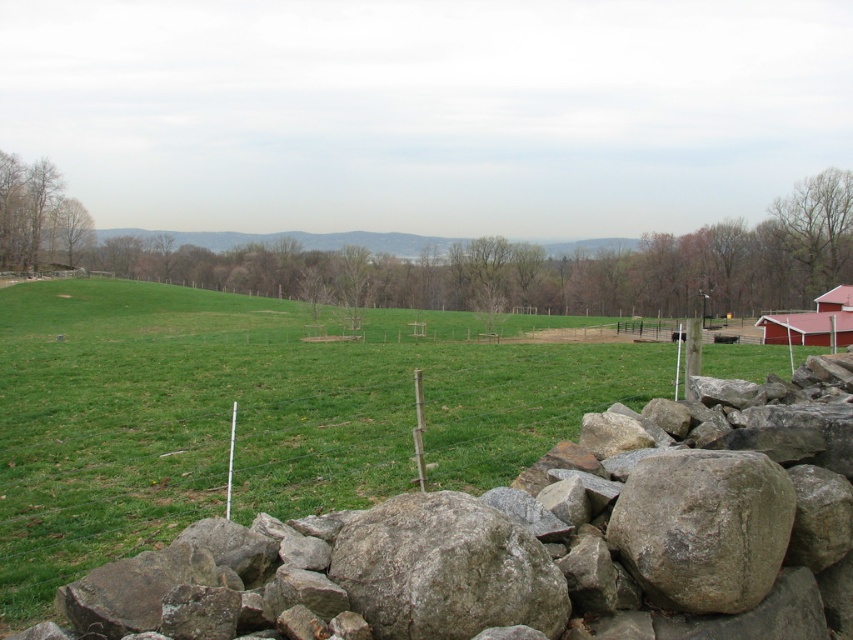
Consider the image. You are a farmer planning to plant crops in the green grassy field at center and the red wooden barn at right. Which area has more space available for planting?

The green grassy field at center has more space available for planting since it is bigger than the red wooden barn at right.